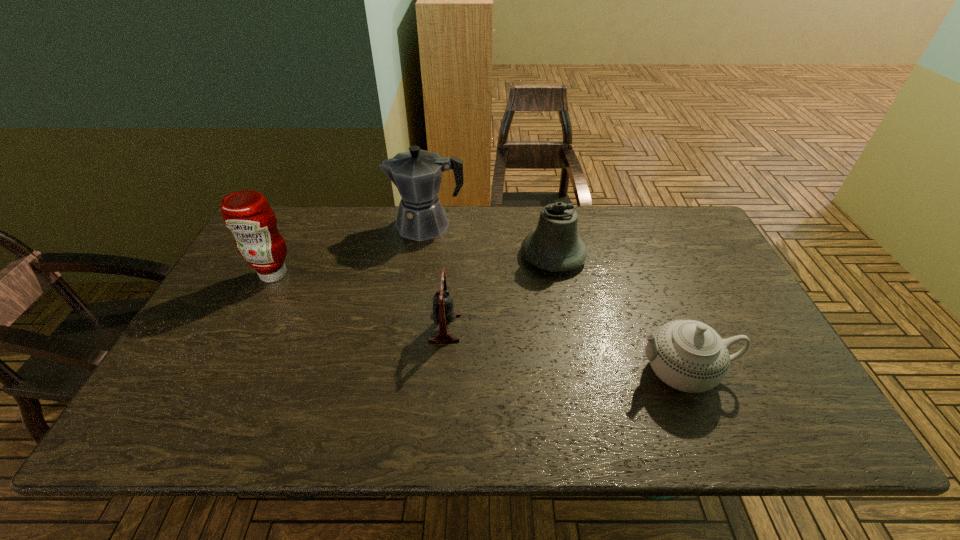
Where is `object located at the near right corner`? The height and width of the screenshot is (540, 960). object located at the near right corner is located at coordinates (688, 355).

Where is `blank space at the far edge of the desktop`? This screenshot has height=540, width=960. blank space at the far edge of the desktop is located at coordinates (592, 249).

What are the coordinates of `vacant space at the near edge of the desktop` in the screenshot? It's located at (659, 420).

This screenshot has height=540, width=960. I want to click on vacant region at the left edge of the desktop, so click(175, 378).

Locate an element on the screen. This screenshot has width=960, height=540. vacant space at the right edge is located at coordinates (717, 256).

Identify the location of free region at the far right corner. (705, 249).

You are a GUI agent. You are given a task and a screenshot of the screen. Output one action in this format:
    pyautogui.click(x=<x>, y=<y>)
    Task: Click on the empty location between the fourth object from left to right and the rightmost object
    
    Given the screenshot: What is the action you would take?
    pyautogui.click(x=618, y=314)

You are a GUI agent. You are given a task and a screenshot of the screen. Output one action in this format:
    pyautogui.click(x=<x>, y=<y>)
    Task: Click on the free spot between the leftmost object and the coffeepot
    The width and height of the screenshot is (960, 540).
    Given the screenshot: What is the action you would take?
    pyautogui.click(x=350, y=249)

Where is `unoccupied position between the coffeepot and the leftmost object`? The image size is (960, 540). unoccupied position between the coffeepot and the leftmost object is located at coordinates (350, 249).

I want to click on vacant space in between the coffeepot and the leftmost object, so click(x=350, y=249).